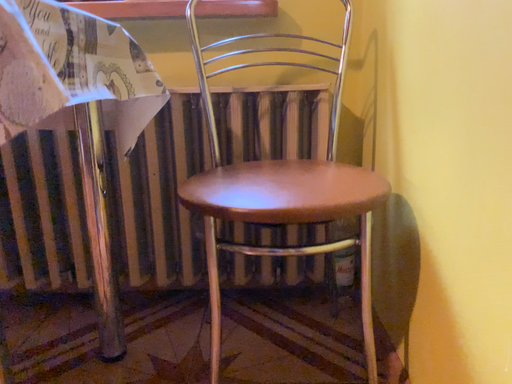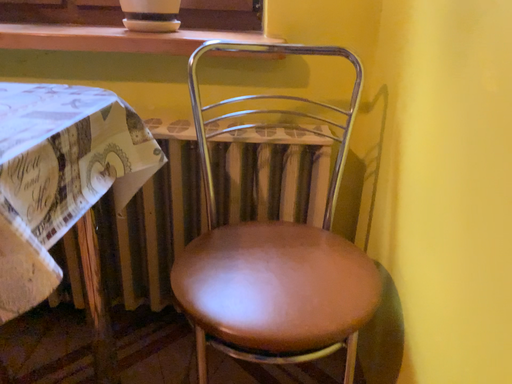
Question: How did the camera likely rotate when shooting the video?

Choices:
 (A) rotated upward
 (B) rotated downward

Answer: (B)